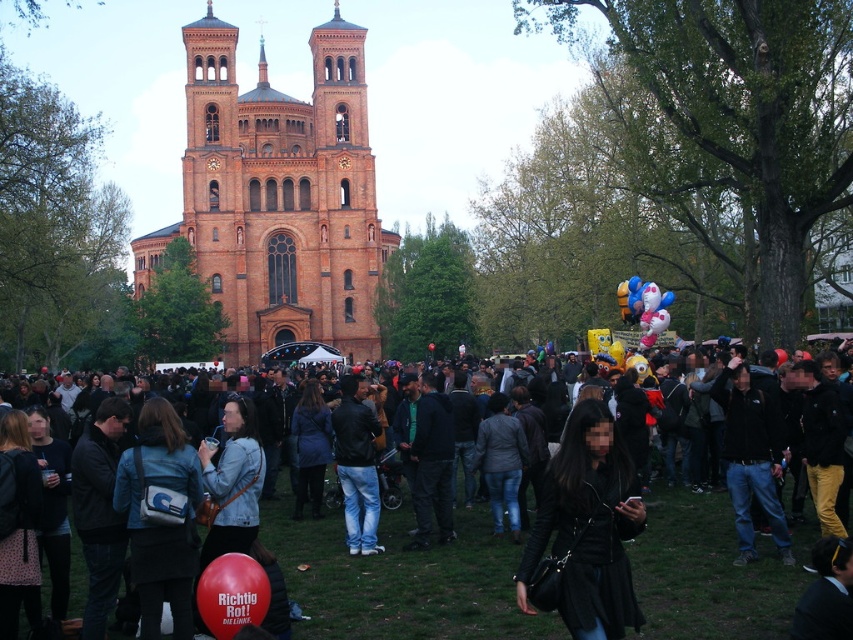
Question: Does brown brick church at upper left have a smaller size compared to dark gray jacket at center?

Choices:
 (A) yes
 (B) no

Answer: (B)

Question: Is black leather jacket at center thinner than rubber balloon at center?

Choices:
 (A) yes
 (B) no

Answer: (B)

Question: Which point is closer to the camera?

Choices:
 (A) (508, 557)
 (B) (192, 499)

Answer: (B)

Question: Estimate the real-world distances between objects in this image. Which object is farther from the black leather jacket at center?

Choices:
 (A) brown brick church at upper left
 (B) rubber balloon at center

Answer: (A)

Question: Does dark gray jacket at center appear under rubber balloon at center?

Choices:
 (A) no
 (B) yes

Answer: (A)

Question: Which object appears farthest from the camera in this image?

Choices:
 (A) multicolored balloons at center
 (B) rubber balloon at center
 (C) black leather jacket at center
 (D) matte blue jacket at center

Answer: (A)